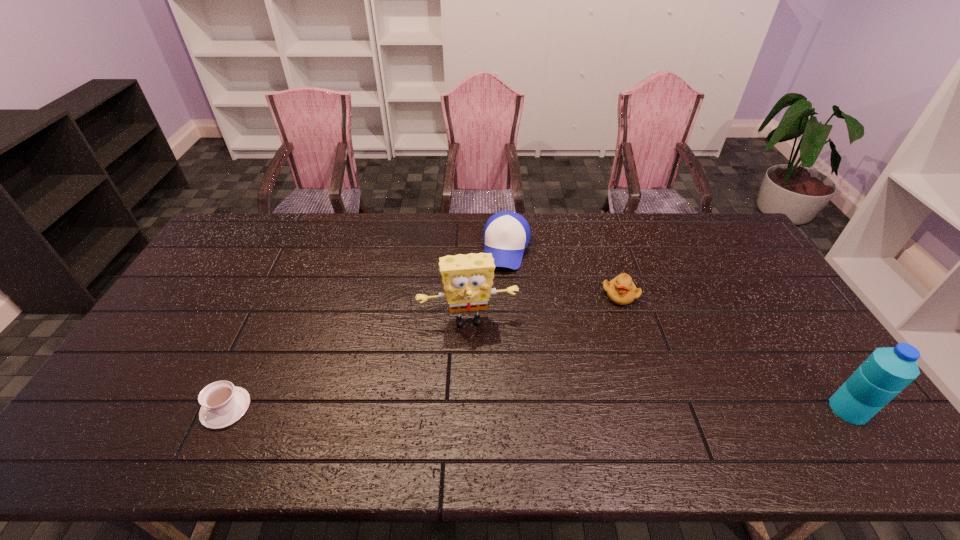
The height and width of the screenshot is (540, 960). In order to click on free space at the near left corner of the desktop in this screenshot , I will do `click(119, 390)`.

Find the location of a particular element. Image resolution: width=960 pixels, height=540 pixels. vacant space at the far right corner of the desktop is located at coordinates (720, 217).

This screenshot has height=540, width=960. Identify the location of empty location between the water bottle and the sponge. (659, 364).

Identify the location of vacant area that lies between the duckling and the farthest object. (564, 272).

Locate an element on the screen. vacant space that's between the sponge and the leftmost object is located at coordinates (347, 364).

This screenshot has height=540, width=960. In order to click on free point between the leftmost object and the third shortest object in this screenshot , I will do `click(367, 328)`.

Find the location of `vacant point located between the third tallest object and the fourth object from left to right`. vacant point located between the third tallest object and the fourth object from left to right is located at coordinates (564, 272).

You are a GUI agent. You are given a task and a screenshot of the screen. Output one action in this format:
    pyautogui.click(x=<x>, y=<y>)
    Task: Click on the free spot between the shortest object and the sponge
    
    Given the screenshot: What is the action you would take?
    pyautogui.click(x=347, y=364)

The width and height of the screenshot is (960, 540). What are the coordinates of `free point between the teacup and the baseball cap` in the screenshot? It's located at (367, 328).

Image resolution: width=960 pixels, height=540 pixels. Find the location of `free space between the rightmost object and the teacup`. free space between the rightmost object and the teacup is located at coordinates (538, 408).